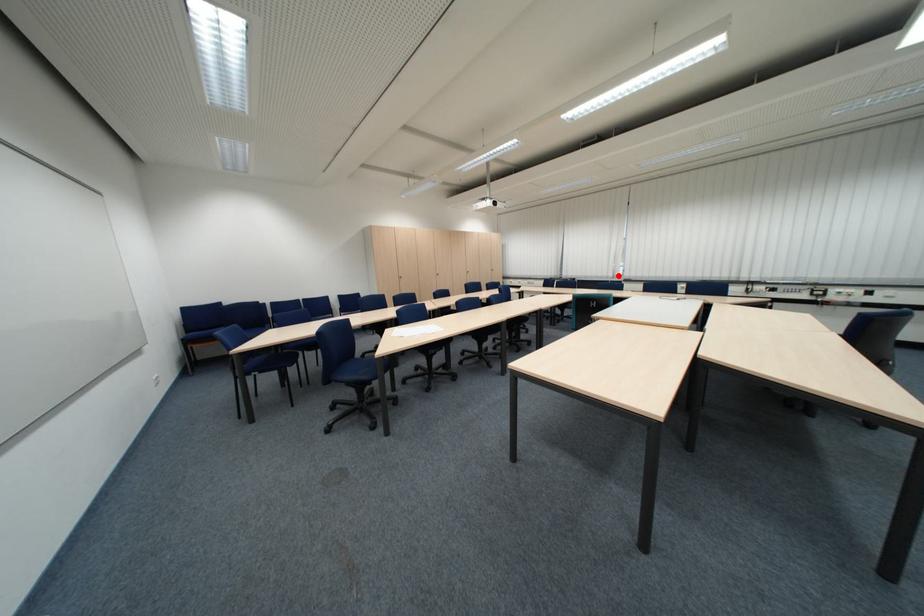
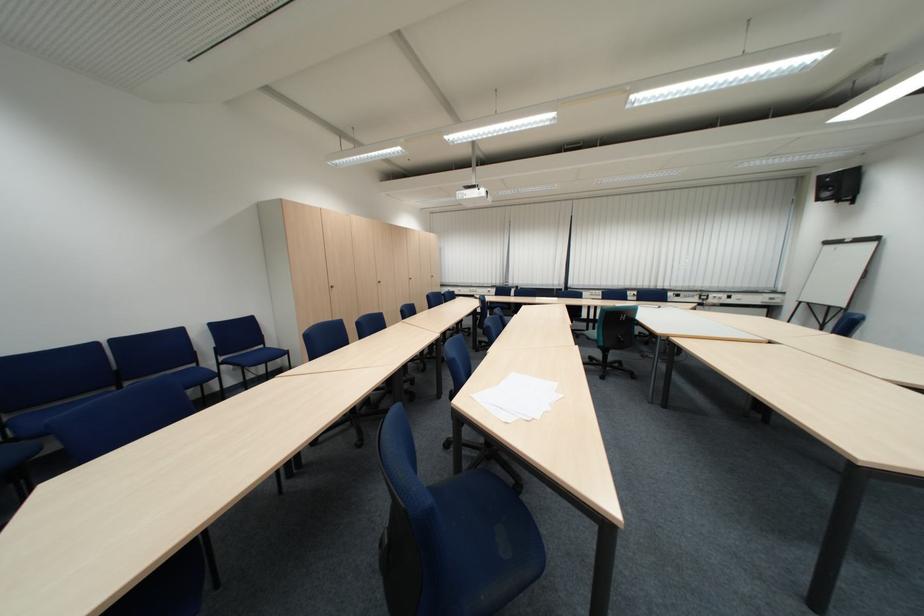
Locate, in the second image, the point that corresponds to the highlighted location in the first image.

(564, 284)